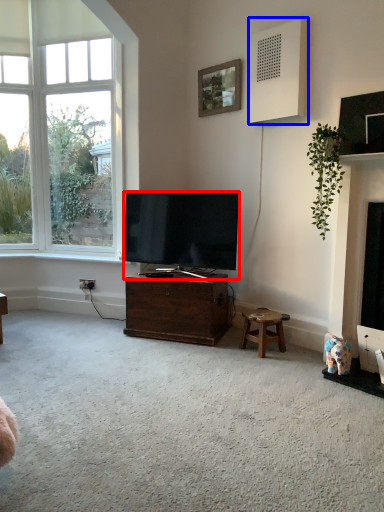
Question: Which of the following is the closest to the observer, television (highlighted by a red box) or speaker (highlighted by a blue box)?

Choices:
 (A) television
 (B) speaker

Answer: (B)